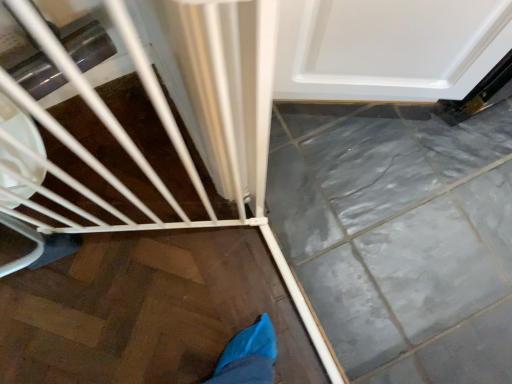
You are a GUI agent. You are given a task and a screenshot of the screen. Output one action in this format:
    pyautogui.click(x=<x>, y=<y>)
    Task: Click on the white matte baby carriage at lower left
    This screenshot has height=384, width=512.
    Given the screenshot: What is the action you would take?
    pyautogui.click(x=115, y=138)

What do you see at coordinates (115, 138) in the screenshot? I see `white matte baby carriage at lower left` at bounding box center [115, 138].

What do you see at coordinates (388, 48) in the screenshot? I see `white glossy door at upper right` at bounding box center [388, 48].

This screenshot has width=512, height=384. Find the location of `white glossy door at upper right`. white glossy door at upper right is located at coordinates (388, 48).

This screenshot has width=512, height=384. I want to click on white matte baby carriage at lower left, so click(115, 138).

Which object is positioned more to the left, white matte baby carriage at lower left or white glossy door at upper right?

white matte baby carriage at lower left.

Is white matte baby carriage at lower left further to camera compared to white glossy door at upper right?

No, it is in front of white glossy door at upper right.

From the picture: Which point is more forward, (68, 147) or (455, 51)?

The point (455, 51) is closer.

From the image's perspective, is white matte baby carriage at lower left positioned above or below white glossy door at upper right?

white matte baby carriage at lower left is situated lower than white glossy door at upper right in the image.

From a real-world perspective, which is physically below, white matte baby carriage at lower left or white glossy door at upper right?

white glossy door at upper right.

Looking at their sizes, would you say white matte baby carriage at lower left is wider or thinner than white glossy door at upper right?

Considering their sizes, white matte baby carriage at lower left looks broader than white glossy door at upper right.

Is white matte baby carriage at lower left shorter than white glossy door at upper right?

No, white matte baby carriage at lower left is not shorter than white glossy door at upper right.

Looking at the image, does white matte baby carriage at lower left seem bigger or smaller compared to white glossy door at upper right?

Considering their sizes, white matte baby carriage at lower left takes up less space than white glossy door at upper right.

Is white glossy door at upper right completely or partially inside white matte baby carriage at lower left?

That's incorrect, white glossy door at upper right is not inside white matte baby carriage at lower left.

Is white matte baby carriage at lower left next to white glossy door at upper right and touching it?

No, white matte baby carriage at lower left is not in contact with white glossy door at upper right.

Is white matte baby carriage at lower left looking in the opposite direction of white glossy door at upper right?

No, white matte baby carriage at lower left's orientation is not away from white glossy door at upper right.

In the image, there is a white glossy door at upper right. Where is `baby carriage below it (from the image's perspective)`? The image size is (512, 384). baby carriage below it (from the image's perspective) is located at coordinates (115, 138).

Between white glossy door at upper right and white matte baby carriage at lower left, which one appears on the left side from the viewer's perspective?

Positioned to the left is white matte baby carriage at lower left.

Is white glossy door at upper right behind white matte baby carriage at lower left?

Yes, the depth of white glossy door at upper right is greater than that of white matte baby carriage at lower left.

Does point (355, 99) appear closer or farther from the camera than point (27, 1)?

Point (355, 99).

From the image's perspective, is white glossy door at upper right located beneath white matte baby carriage at lower left?

No.

From a real-world perspective, which object rests below the other?

white glossy door at upper right is physically lower.

Which of these two, white glossy door at upper right or white matte baby carriage at lower left, is thinner?

white glossy door at upper right.

Considering the sizes of objects white glossy door at upper right and white matte baby carriage at lower left in the image provided, who is taller, white glossy door at upper right or white matte baby carriage at lower left?

With more height is white matte baby carriage at lower left.

Considering the relative sizes of white glossy door at upper right and white matte baby carriage at lower left in the image provided, is white glossy door at upper right smaller than white matte baby carriage at lower left?

Actually, white glossy door at upper right might be larger than white matte baby carriage at lower left.

In the scene shown: Is white glossy door at upper right not within white matte baby carriage at lower left?

Absolutely, white glossy door at upper right is external to white matte baby carriage at lower left.

Is there a large distance between white glossy door at upper right and white matte baby carriage at lower left?

No, white glossy door at upper right is not far from white matte baby carriage at lower left.

Is white glossy door at upper right looking in the opposite direction of white matte baby carriage at lower left?

No, white glossy door at upper right's orientation is not away from white matte baby carriage at lower left.

Can you tell me how much white glossy door at upper right and white matte baby carriage at lower left differ in facing direction?

They differ by 96.5 degrees in their facing directions.

Locate an element on the screen. baby carriage on the left of the white glossy door at upper right is located at coordinates (115, 138).

At what (x,y) coordinates should I click in order to perform the action: click on door lying on the right of white matte baby carriage at lower left. Please return your answer as a coordinate pair (x, y). The width and height of the screenshot is (512, 384). Looking at the image, I should click on (388, 48).

You are a GUI agent. You are given a task and a screenshot of the screen. Output one action in this format:
    pyautogui.click(x=<x>, y=<y>)
    Task: Click on the baby carriage that is above the white glossy door at upper right (from a real-world perspective)
    
    Given the screenshot: What is the action you would take?
    click(x=115, y=138)